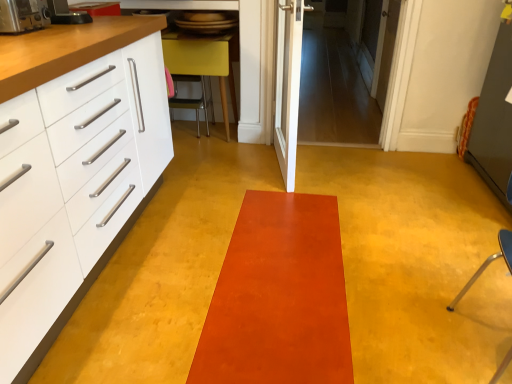
Question: Which direction should I rotate to look at matte yellow chair at center, acting as the 1th furniture starting from the left, — up or down?

Choices:
 (A) up
 (B) down

Answer: (A)

Question: Is white glossy door at center, acting as the second door starting from the right, further to the viewer compared to matte yellow chair at center, acting as the 1th furniture starting from the left?

Choices:
 (A) no
 (B) yes

Answer: (A)

Question: Is white glossy door at center, the first door in the front-to-back sequence, oriented away from matte yellow chair at center, the 2th furniture viewed from the front?

Choices:
 (A) yes
 (B) no

Answer: (B)

Question: From a real-world perspective, is white glossy door at center, placed as the second door when sorted from back to front, below matte yellow chair at center, the 2th furniture viewed from the front?

Choices:
 (A) no
 (B) yes

Answer: (A)

Question: Can you confirm if white glossy door at center, the first door in the front-to-back sequence, is smaller than matte yellow chair at center, acting as the 1th furniture starting from the left?

Choices:
 (A) yes
 (B) no

Answer: (A)

Question: Does white glossy door at center, acting as the second door starting from the right, have a larger size compared to matte yellow chair at center, acting as the 1th furniture starting from the left?

Choices:
 (A) no
 (B) yes

Answer: (A)

Question: Is white glossy door at center, placed as the second door when sorted from back to front, to the right of matte yellow chair at center, the 1th furniture from the top, from the viewer's perspective?

Choices:
 (A) yes
 (B) no

Answer: (A)

Question: From a real-world perspective, is white glossy cabinet at left positioned under metallic silver toaster at left, placed as the second appliance when sorted from front to back, based on gravity?

Choices:
 (A) no
 (B) yes

Answer: (B)

Question: Considering the relative positions of white glossy cabinet at left and metallic silver toaster at left, placed as the second appliance when sorted from front to back, in the image provided, is white glossy cabinet at left behind metallic silver toaster at left, placed as the second appliance when sorted from front to back,?

Choices:
 (A) no
 (B) yes

Answer: (A)

Question: Could you tell me if white glossy cabinet at left is turned towards metallic silver toaster at left, placed as the second appliance when sorted from front to back?

Choices:
 (A) yes
 (B) no

Answer: (B)

Question: Is white glossy cabinet at left thinner than metallic silver toaster at left, the first appliance from the back?

Choices:
 (A) yes
 (B) no

Answer: (B)

Question: Is white glossy cabinet at left taller than metallic silver toaster at left, placed as the second appliance when sorted from front to back?

Choices:
 (A) yes
 (B) no

Answer: (A)

Question: Can you see white glossy cabinet at left touching metallic silver toaster at left, placed as the second appliance when sorted from front to back?

Choices:
 (A) yes
 (B) no

Answer: (B)

Question: Can you confirm if satin orange mat at center is taller than metallic silver toaster at left, the 2th appliance from the back?

Choices:
 (A) yes
 (B) no

Answer: (B)